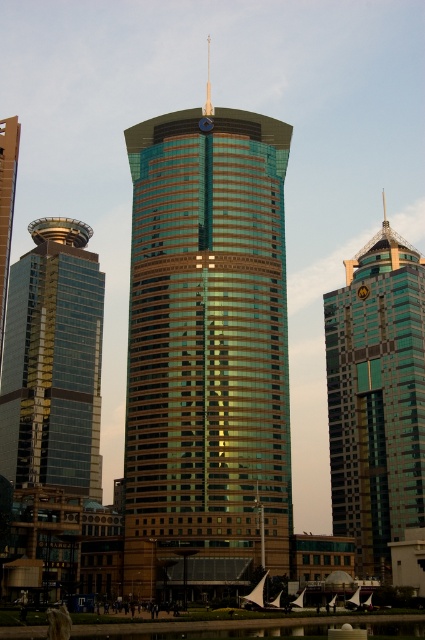
You are an architect evaluating the skyline of this city. You notice the green glassy tower at center and the green glass skyscraper at upper right. Which of these two structures is taller?

The green glassy tower at center is taller than the green glass skyscraper at upper right according to the description provided.

You are an architect analyzing the urban layout. From your current viewpoint, which of the two buildings, the green glassy tower at center or the green glass skyscraper at upper right, appears closer to you?

The green glassy tower at center appears closer because it is positioned in front of the green glass skyscraper at upper right.